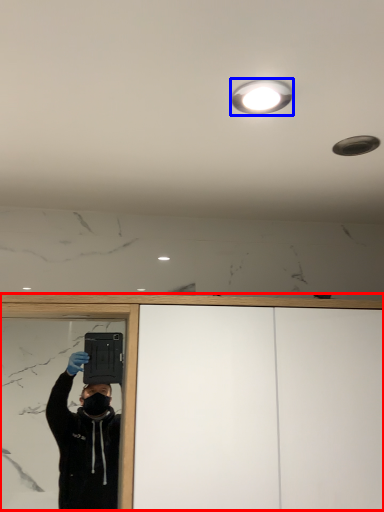
Question: Which point is closer to the camera, dresser (highlighted by a red box) or droplight (highlighted by a blue box)?

Choices:
 (A) dresser
 (B) droplight

Answer: (B)